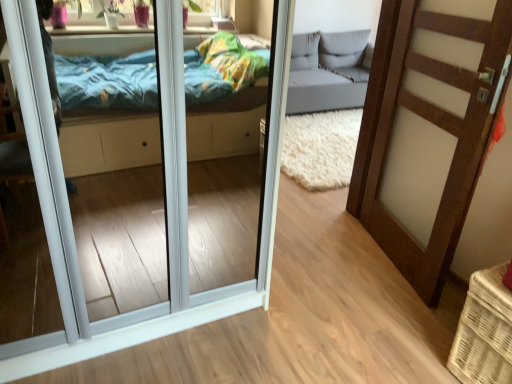
Measure the distance between brown wood door at right, placed as the 1th door when sorted from right to left, and camera.

brown wood door at right, placed as the 1th door when sorted from right to left, is 4.95 feet away from camera.

Where is `white glossy door at center, acting as the 2th door starting from the right`? The height and width of the screenshot is (384, 512). white glossy door at center, acting as the 2th door starting from the right is located at coordinates (164, 176).

This screenshot has width=512, height=384. What are the coordinates of `white wicker basket at lower right` in the screenshot? It's located at (484, 331).

Identify the location of brown wood door at right, which is the 2th door from left to right. (430, 129).

Which is further, (480,272) or (25,36)?

The point (480,272) is farther from the camera.

Is white wicker basket at lower right positioned beyond the bounds of white glossy door at center, acting as the 2th door starting from the right?

white wicker basket at lower right is positioned outside white glossy door at center, acting as the 2th door starting from the right.

Considering the sizes of objects white wicker basket at lower right and white glossy door at center, acting as the 2th door starting from the right, in the image provided, who is shorter, white wicker basket at lower right or white glossy door at center, acting as the 2th door starting from the right,?

With less height is white wicker basket at lower right.

Who is bigger, white wicker basket at lower right or white glossy door at center, acting as the 2th door starting from the right?

white glossy door at center, acting as the 2th door starting from the right, is bigger.

Does white wicker basket at lower right have a lesser height compared to brown wood door at right, which is the 2th door from left to right?

Yes, white wicker basket at lower right is shorter than brown wood door at right, which is the 2th door from left to right.

How far apart are white wicker basket at lower right and brown wood door at right, placed as the 1th door when sorted from right to left?

They are 27.26 inches apart.

Between white wicker basket at lower right and brown wood door at right, placed as the 1th door when sorted from right to left, which one has smaller size?

Smaller between the two is brown wood door at right, placed as the 1th door when sorted from right to left.

Between point (503, 381) and point (366, 208), which one is positioned behind?

Point (366, 208)

Looking at this image, are white glossy door at center, positioned as the 1th door in left-to-right order, and brown wood door at right, which is the 2th door from left to right, beside each other?

No.

Which object is positioned more to the left, white glossy door at center, positioned as the 1th door in left-to-right order, or brown wood door at right, placed as the 1th door when sorted from right to left?

From the viewer's perspective, white glossy door at center, positioned as the 1th door in left-to-right order, appears more on the left side.

At what (x,y) coordinates should I click in order to perform the action: click on door above the white glossy door at center, acting as the 2th door starting from the right (from a real-world perspective). Please return your answer as a coordinate pair (x, y). The width and height of the screenshot is (512, 384). Looking at the image, I should click on (430, 129).

From a real-world perspective, is white glossy door at center, acting as the 2th door starting from the right, located higher than brown wood door at right, placed as the 1th door when sorted from right to left?

No, from a real-world perspective, white glossy door at center, acting as the 2th door starting from the right, is not over brown wood door at right, placed as the 1th door when sorted from right to left

Which object is further away from the camera, brown wood door at right, placed as the 1th door when sorted from right to left, or white glossy door at center, acting as the 2th door starting from the right?

brown wood door at right, placed as the 1th door when sorted from right to left, is further from the camera.

How many degrees apart are the facing directions of brown wood door at right, placed as the 1th door when sorted from right to left, and white glossy door at center, positioned as the 1th door in left-to-right order?

There is a 106-degree angle between the facing directions of brown wood door at right, placed as the 1th door when sorted from right to left, and white glossy door at center, positioned as the 1th door in left-to-right order.

Is brown wood door at right, which is the 2th door from left to right, aimed at white glossy door at center, acting as the 2th door starting from the right?

Yes.

Is brown wood door at right, which is the 2th door from left to right, at the left side of white glossy door at center, acting as the 2th door starting from the right?

In fact, brown wood door at right, which is the 2th door from left to right, is to the right of white glossy door at center, acting as the 2th door starting from the right.

Between white glossy door at center, positioned as the 1th door in left-to-right order, and white wicker basket at lower right, which one has more height?

white glossy door at center, positioned as the 1th door in left-to-right order.

In the image, is white glossy door at center, positioned as the 1th door in left-to-right order, positioned in front of or behind white wicker basket at lower right?

Visually, white glossy door at center, positioned as the 1th door in left-to-right order, is located in front of white wicker basket at lower right.

Which is in front, point (277, 114) or point (486, 374)?

Positioned in front is point (277, 114).

Who is bigger, white glossy door at center, positioned as the 1th door in left-to-right order, or white wicker basket at lower right?

white glossy door at center, positioned as the 1th door in left-to-right order.

How different are the orientations of brown wood door at right, placed as the 1th door when sorted from right to left, and white wicker basket at lower right in degrees?

brown wood door at right, placed as the 1th door when sorted from right to left, and white wicker basket at lower right are facing 15.6 degrees away from each other.

Does brown wood door at right, which is the 2th door from left to right, contain white wicker basket at lower right?

No, brown wood door at right, which is the 2th door from left to right, does not contain white wicker basket at lower right.

The width and height of the screenshot is (512, 384). In order to click on door behind the white wicker basket at lower right in this screenshot , I will do `click(430, 129)`.

Between brown wood door at right, placed as the 1th door when sorted from right to left, and white wicker basket at lower right, which one appears on the right side from the viewer's perspective?

white wicker basket at lower right.

This screenshot has height=384, width=512. What are the coordinates of `basket below the white glossy door at center, positioned as the 1th door in left-to-right order (from the image's perspective)` in the screenshot? It's located at (484, 331).

This screenshot has width=512, height=384. In order to click on basket on the right side of brown wood door at right, placed as the 1th door when sorted from right to left in this screenshot , I will do `click(484, 331)`.

Which object lies further to the anchor point white glossy door at center, positioned as the 1th door in left-to-right order, white wicker basket at lower right or brown wood door at right, which is the 2th door from left to right?

white wicker basket at lower right lies further to white glossy door at center, positioned as the 1th door in left-to-right order, than the other object.

When comparing their distances from white wicker basket at lower right, does white glossy door at center, positioned as the 1th door in left-to-right order, or brown wood door at right, placed as the 1th door when sorted from right to left, seem closer?

The object closer to white wicker basket at lower right is brown wood door at right, placed as the 1th door when sorted from right to left.

When comparing their distances from white wicker basket at lower right, does brown wood door at right, which is the 2th door from left to right, or white glossy door at center, positioned as the 1th door in left-to-right order, seem closer?

Based on the image, brown wood door at right, which is the 2th door from left to right, appears to be nearer to white wicker basket at lower right.

Which object lies further to the anchor point brown wood door at right, placed as the 1th door when sorted from right to left, white wicker basket at lower right or white glossy door at center, acting as the 2th door starting from the right?

white glossy door at center, acting as the 2th door starting from the right, lies further to brown wood door at right, placed as the 1th door when sorted from right to left, than the other object.

When comparing their distances from brown wood door at right, which is the 2th door from left to right, does white glossy door at center, acting as the 2th door starting from the right, or white wicker basket at lower right seem further?

Based on the image, white glossy door at center, acting as the 2th door starting from the right, appears to be further to brown wood door at right, which is the 2th door from left to right.

Looking at the image, which one is located closer to white glossy door at center, acting as the 2th door starting from the right, brown wood door at right, which is the 2th door from left to right, or white wicker basket at lower right?

Among the two, brown wood door at right, which is the 2th door from left to right, is located nearer to white glossy door at center, acting as the 2th door starting from the right.

Find the location of `door between white glossy door at center, acting as the 2th door starting from the right, and white wicker basket at lower right`. door between white glossy door at center, acting as the 2th door starting from the right, and white wicker basket at lower right is located at coordinates (430, 129).